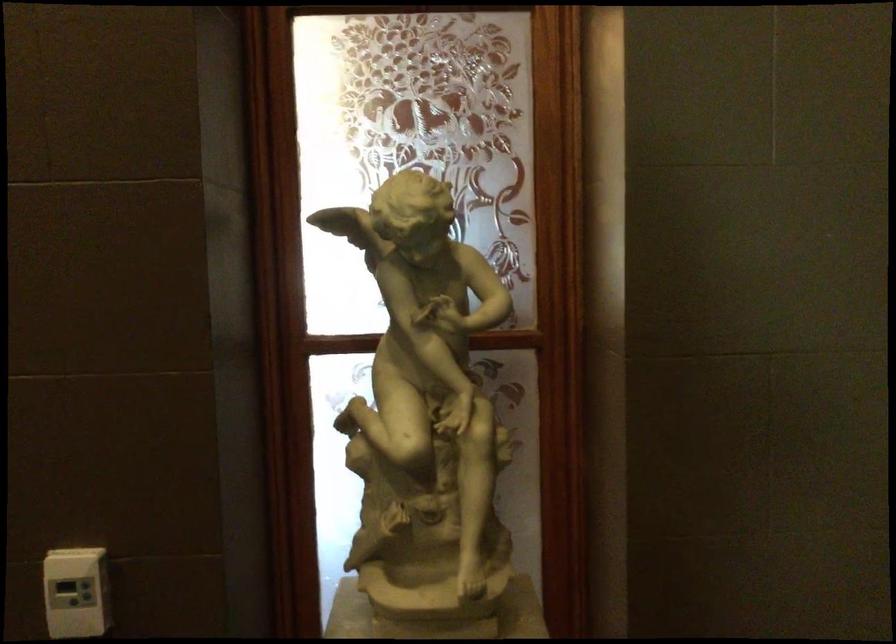
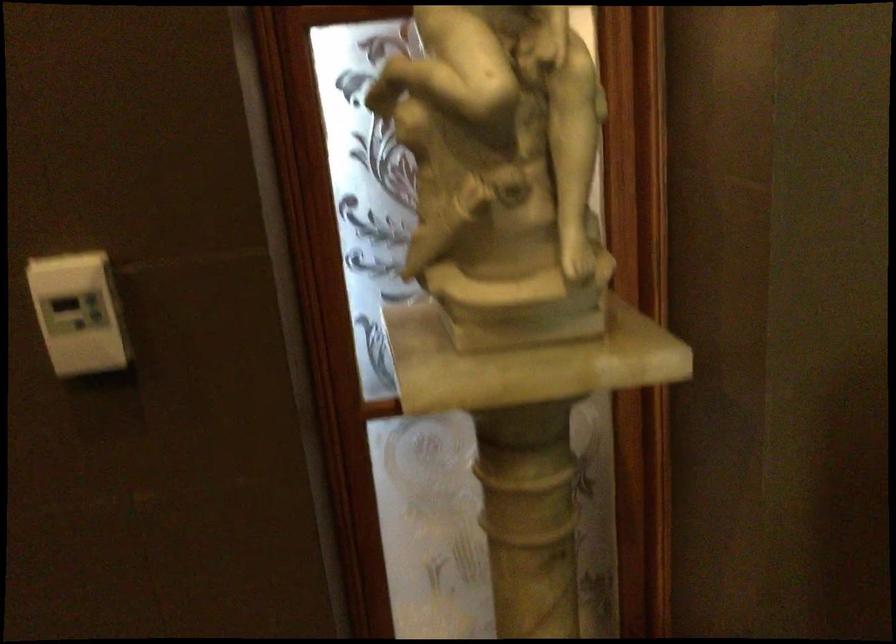
In the second image, find the point that corresponds to point (419, 500) in the first image.

(502, 172)